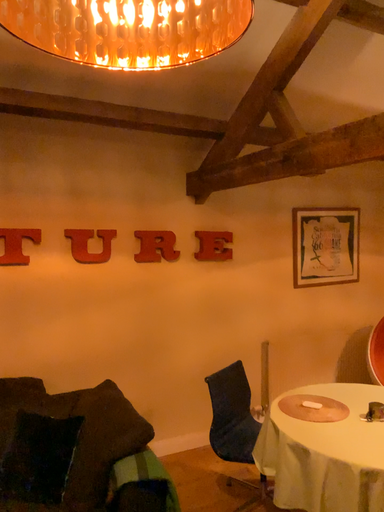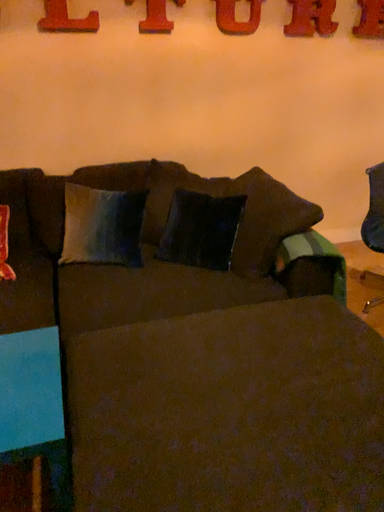
Question: Which way did the camera rotate in the video?

Choices:
 (A) rotated downward
 (B) rotated upward

Answer: (A)